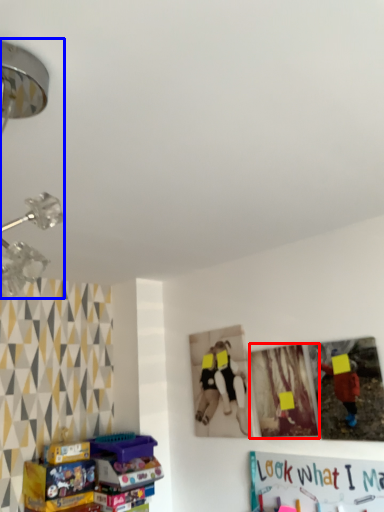
Question: Which point is closer to the camera, picture frame (highlighted by a red box) or lamp (highlighted by a blue box)?

Choices:
 (A) picture frame
 (B) lamp

Answer: (B)